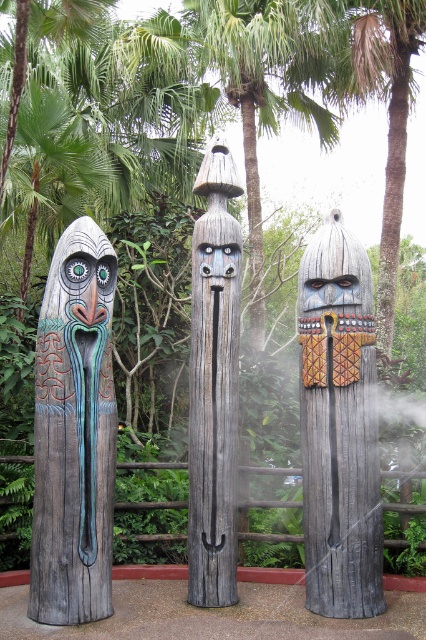
Question: Which object appears closest to the camera in this image?

Choices:
 (A) wooden totem at center
 (B) wooden totem pole at center
 (C) matte wood mask at left

Answer: (C)

Question: Which object appears closest to the camera in this image?

Choices:
 (A) matte wood mask at left
 (B) carved wood totem at left

Answer: (B)

Question: Which object appears farthest from the camera in this image?

Choices:
 (A) matte wood mask at left
 (B) carved wood totem at left
 (C) wooden totem at center

Answer: (C)

Question: Does carved wood totem at left appear under wooden totem pole at center?

Choices:
 (A) no
 (B) yes

Answer: (B)

Question: Considering the relative positions of carved wood totem at left and wooden totem at center in the image provided, where is carved wood totem at left located with respect to wooden totem at center?

Choices:
 (A) below
 (B) above

Answer: (A)

Question: Is wooden totem pole at center to the right of matte wood mask at left from the viewer's perspective?

Choices:
 (A) yes
 (B) no

Answer: (A)